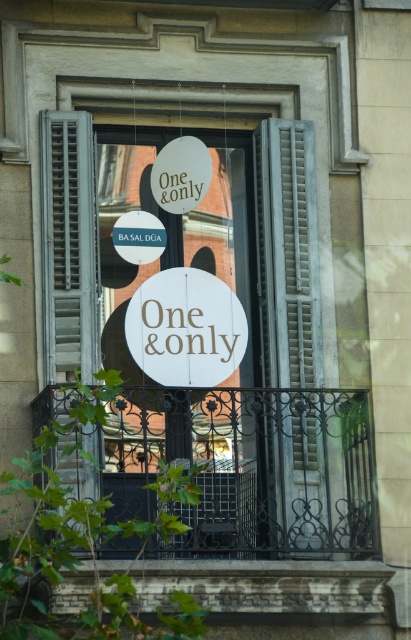
Who is taller, white paper sign at center or white wood sign at center?

Standing taller between the two is white paper sign at center.

Identify the location of white paper sign at center. The image size is (411, 640). (219, 348).

Where is `white paper sign at center`? This screenshot has width=411, height=640. white paper sign at center is located at coordinates (219, 348).

From the picture: Is gray textured shutter at right closer to the viewer compared to white wood sign at center?

No.

Measure the distance from gray textured shutter at right to white wood sign at center.

They are 4.02 meters apart.

Identify the location of gray textured shutter at right. The image size is (411, 640). (288, 256).

Does point (60, 163) lie behind point (318, 336)?

No.

Does point (85, 330) come in front of point (302, 150)?

Yes, point (85, 330) is in front of point (302, 150).

I want to click on white paper sign at center, so click(219, 348).